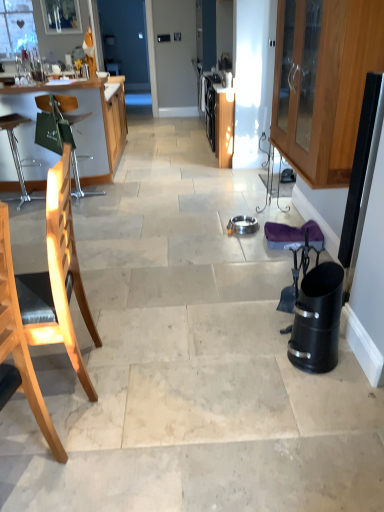
The image size is (384, 512). Identify the location of vacant space in between black plastic trash can at right and light wood chair at left, positioned as the 2th chair in back-to-front order. (188, 367).